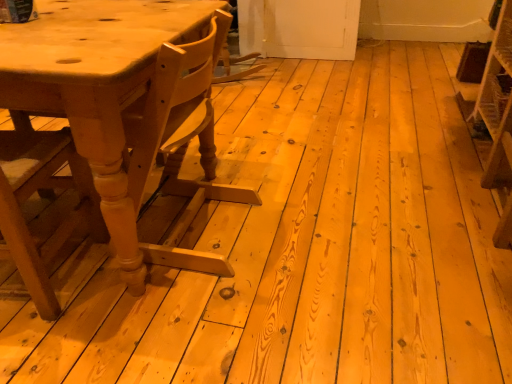
What are the coordinates of `free point behind wooden crate at right` in the screenshot? It's located at (422, 121).